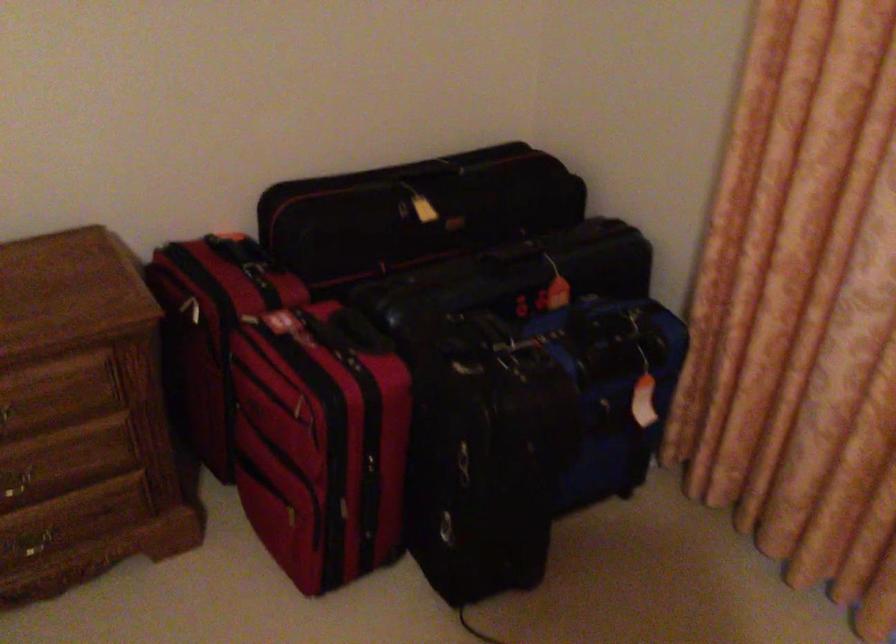
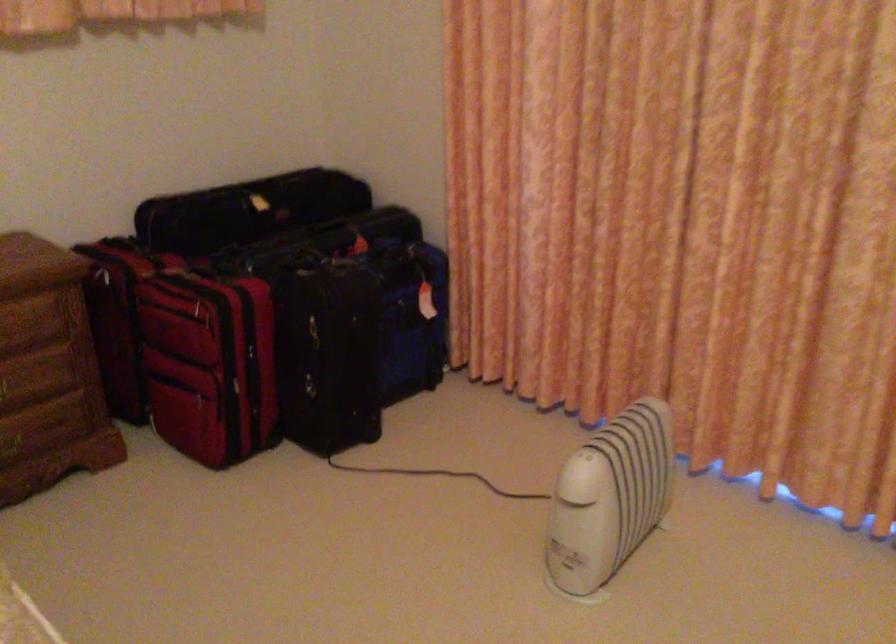
Where in the second image is the point corresponding to (x=304, y=399) from the first image?

(202, 305)